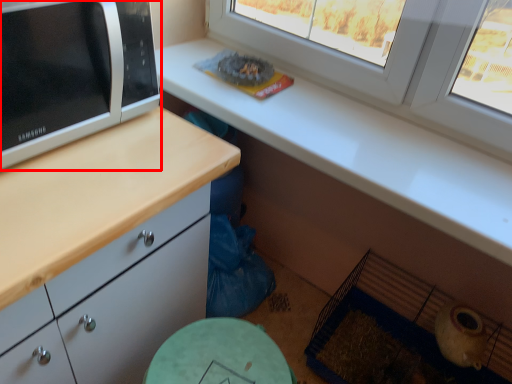
Question: Considering the relative positions of microwave oven (annotated by the red box) and window in the image provided, where is microwave oven (annotated by the red box) located with respect to the staircase?

Choices:
 (A) right
 (B) left

Answer: (B)